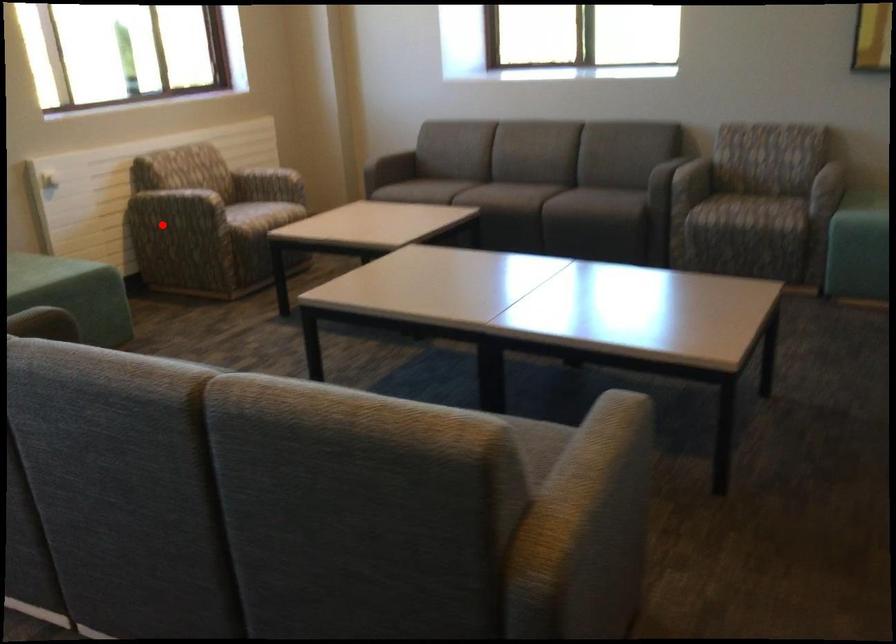
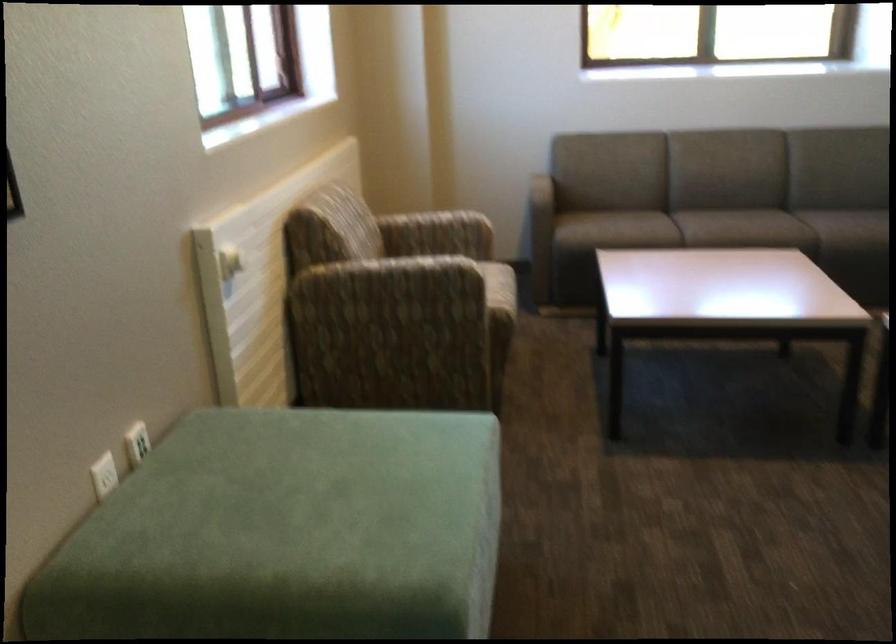
Question: I am providing you with two images of the same scene from different viewpoints. Given a red point in image1, look at the same physical point in image2. Is it:

Choices:
 (A) Closer to the viewpoint
 (B) Farther from the viewpoint

Answer: (A)